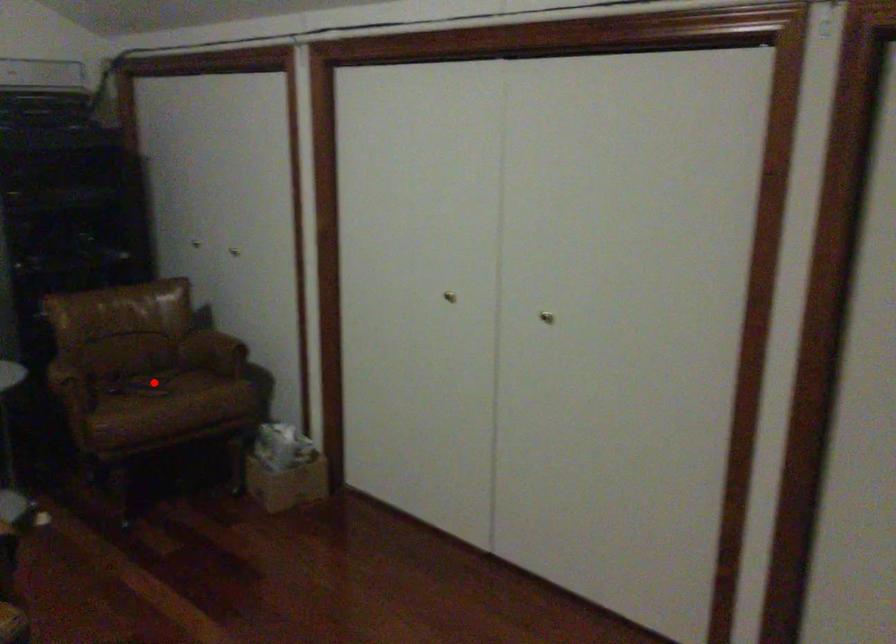
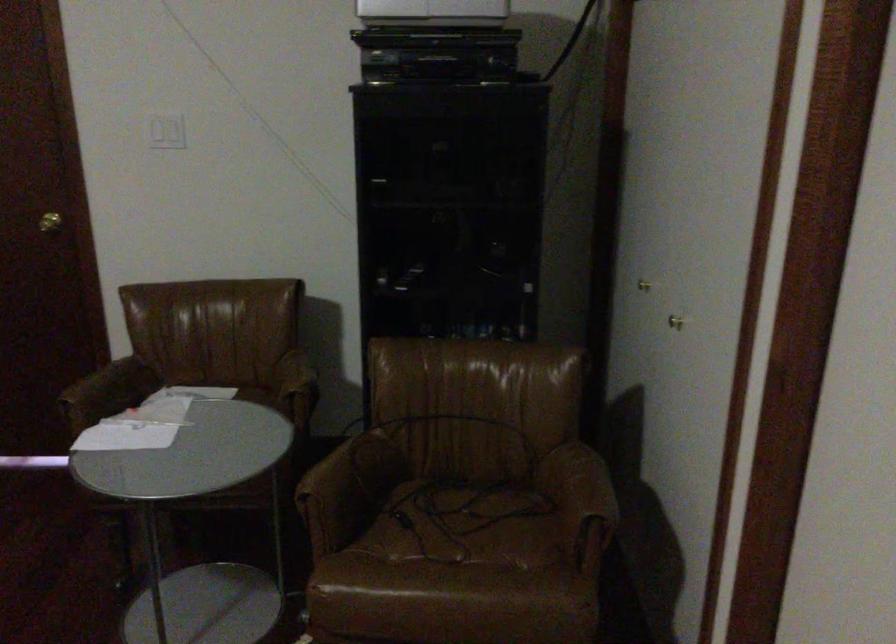
Question: A red point is marked in image1. In image2, is the corresponding 3D point closer to the camera or farther? Reply with the corresponding letter.

Choices:
 (A) The corresponding 3D point is closer.
 (B) The corresponding 3D point is farther.

Answer: (A)